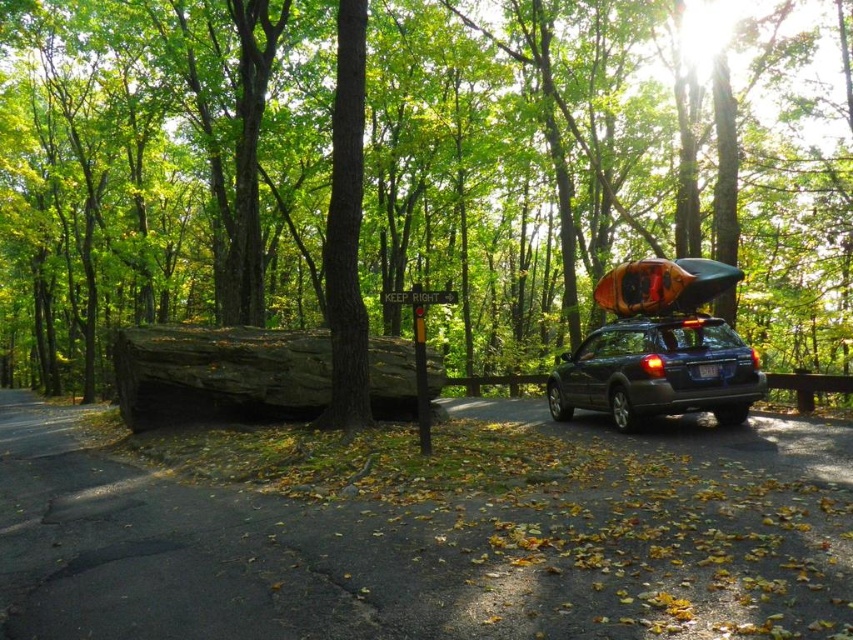
Is green leafy tree at center taller than matte dark blue suv at center-right?

Correct, green leafy tree at center is much taller as matte dark blue suv at center-right.

Identify the location of green leafy tree at center. Image resolution: width=853 pixels, height=640 pixels. (605, 170).

Between green leafy tree at center and dark gray rock at center, which one appears on the left side from the viewer's perspective?

From the viewer's perspective, green leafy tree at center appears more on the left side.

Does green leafy tree at center have a greater height compared to dark gray rock at center?

Yes, green leafy tree at center is taller than dark gray rock at center.

Is point (712, 193) farther from camera compared to point (245, 378)?

Yes, it is.

The image size is (853, 640). Find the location of `green leafy tree at center`. green leafy tree at center is located at coordinates (605, 170).

Is dark gray rock at center shorter than matte dark blue suv at center-right?

Correct, dark gray rock at center is not as tall as matte dark blue suv at center-right.

Does dark gray rock at center have a greater width compared to matte dark blue suv at center-right?

No, dark gray rock at center is not wider than matte dark blue suv at center-right.

Does point (308, 387) come behind point (689, 396)?

Yes, point (308, 387) is farther from viewer.

Identify the location of dark gray rock at center. The width and height of the screenshot is (853, 640). (219, 372).